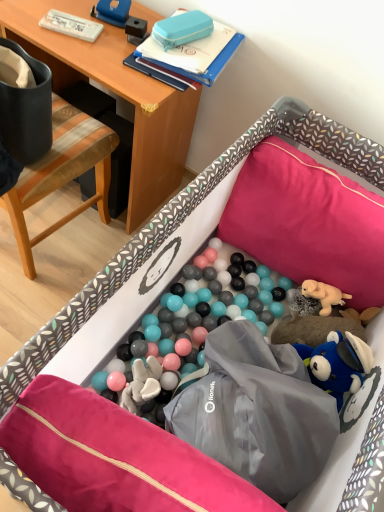
What are the coordinates of `pink fabric pillow at center, which appears as the 2th pillow when viewed from the back` in the screenshot? It's located at click(114, 457).

The width and height of the screenshot is (384, 512). Describe the element at coordinates (114, 92) in the screenshot. I see `wooden desk at upper left` at that location.

Where is `blue hard plastic case at upper center`? The width and height of the screenshot is (384, 512). blue hard plastic case at upper center is located at coordinates (182, 29).

The image size is (384, 512). Identify the location of pink fabric pillow at center, which is the second pillow in top-to-bottom order. (114, 457).

From a real-world perspective, is blue hard plastic case at upper center above or below pink fabric pillow at center, which is counted as the second pillow, starting from the right?

From a real-world perspective, blue hard plastic case at upper center is physically above pink fabric pillow at center, which is counted as the second pillow, starting from the right.

Which object is wider, blue hard plastic case at upper center or pink fabric pillow at center, which ranks as the 1th pillow in front-to-back order?

With larger width is blue hard plastic case at upper center.

Is blue hard plastic case at upper center in contact with pink fabric pillow at center, positioned as the 1th pillow in bottom-to-top order?

There is a gap between blue hard plastic case at upper center and pink fabric pillow at center, positioned as the 1th pillow in bottom-to-top order.

Is blue hard plastic case at upper center shorter than pink fabric pillow at center, which is the first pillow in left-to-right order?

Yes, blue hard plastic case at upper center is shorter than pink fabric pillow at center, which is the first pillow in left-to-right order.

From the picture: Which is behind, pink fabric pillow at upper right, which ranks as the first pillow in back-to-front order, or blue hard plastic case at upper center?

blue hard plastic case at upper center is more distant.

Can you confirm if pink fabric pillow at upper right, the 2th pillow positioned from the front, is taller than blue hard plastic case at upper center?

Yes.

From the image's perspective, which one is positioned lower, pink fabric pillow at upper right, which is counted as the second pillow, starting from the left, or blue hard plastic case at upper center?

pink fabric pillow at upper right, which is counted as the second pillow, starting from the left, is shown below in the image.

Is pink fabric pillow at upper right, which is counted as the second pillow, starting from the left, positioned with its back to blue hard plastic case at upper center?

pink fabric pillow at upper right, which is counted as the second pillow, starting from the left, does not have its back to blue hard plastic case at upper center.

From a real-world perspective, is wooden desk at upper left over pink fabric pillow at center, which ranks as the 1th pillow in front-to-back order?

No.

Based on the photo, is wooden desk at upper left to the right of pink fabric pillow at center, which ranks as the 1th pillow in front-to-back order, from the viewer's perspective?

No.

From the image's perspective, does wooden desk at upper left appear lower than pink fabric pillow at center, which is counted as the second pillow, starting from the right?

Actually, wooden desk at upper left appears above pink fabric pillow at center, which is counted as the second pillow, starting from the right, in the image.

Is wooden desk at upper left positioned with its back to pink fabric pillow at center, which is the second pillow in top-to-bottom order?

No, wooden desk at upper left's orientation is not away from pink fabric pillow at center, which is the second pillow in top-to-bottom order.

From a real-world perspective, which is physically below, pink fabric pillow at upper right, which ranks as the first pillow in back-to-front order, or pink fabric pillow at center, which is counted as the second pillow, starting from the right?

From a 3D spatial view, pink fabric pillow at center, which is counted as the second pillow, starting from the right, is below.

Which point is more forward, (371, 287) or (220, 485)?

The point (220, 485) is closer.

From the image's perspective, which object appears higher, pink fabric pillow at upper right, the 1th pillow positioned from the right, or pink fabric pillow at center, which is the first pillow in left-to-right order?

pink fabric pillow at upper right, the 1th pillow positioned from the right, is shown above in the image.

Can you tell me how much pink fabric pillow at upper right, the 1th pillow when ordered from top to bottom, and wooden desk at upper left differ in facing direction?

There is a 90.2-degree angle between the facing directions of pink fabric pillow at upper right, the 1th pillow when ordered from top to bottom, and wooden desk at upper left.

From a real-world perspective, who is located higher, pink fabric pillow at upper right, the 2th pillow positioned from the front, or wooden desk at upper left?

pink fabric pillow at upper right, the 2th pillow positioned from the front, is physically above.

Is pink fabric pillow at upper right, placed as the 2th pillow when sorted from bottom to top, in front of or behind wooden desk at upper left in the image?

In the image, pink fabric pillow at upper right, placed as the 2th pillow when sorted from bottom to top, appears in front of wooden desk at upper left.

How much distance is there between pink fabric pillow at upper right, the 1th pillow when ordered from top to bottom, and wooden desk at upper left?

pink fabric pillow at upper right, the 1th pillow when ordered from top to bottom, is 57.94 centimeters away from wooden desk at upper left.

Is point (203, 37) farther from camera compared to point (128, 217)?

That is False.

Which object is further away from the camera, blue hard plastic case at upper center or wooden desk at upper left?

blue hard plastic case at upper center is further from the camera.

Is blue hard plastic case at upper center spatially inside wooden desk at upper left, or outside of it?

blue hard plastic case at upper center exists outside the volume of wooden desk at upper left.

Consider the image. Who is bigger, blue hard plastic case at upper center or wooden desk at upper left?

wooden desk at upper left.

Does woodenchair at left touch pink fabric pillow at upper right, which is counted as the second pillow, starting from the left?

No.

Is pink fabric pillow at upper right, placed as the 2th pillow when sorted from bottom to top, located within woodenchair at left?

No.

Which is nearer, [28,191] or [292,214]?

Point [28,191].

How different are the orientations of woodenchair at left and pink fabric pillow at upper right, placed as the 2th pillow when sorted from bottom to top, in degrees?

woodenchair at left and pink fabric pillow at upper right, placed as the 2th pillow when sorted from bottom to top, are facing 88.4 degrees away from each other.

The width and height of the screenshot is (384, 512). Find the location of `toy on the left of pink fabric pillow at center, which appears as the 2th pillow when viewed from the back`. toy on the left of pink fabric pillow at center, which appears as the 2th pillow when viewed from the back is located at coordinates (182, 29).

From the image's perspective, which pillow is the 1st one below the blue hard plastic case at upper center? Please provide its 2D coordinates.

[(307, 222)]

Estimate the real-world distances between objects in this image. Which object is closer to pink fabric pillow at upper right, which is counted as the second pillow, starting from the left, wooden desk at upper left or blue hard plastic case at upper center?

The object closer to pink fabric pillow at upper right, which is counted as the second pillow, starting from the left, is wooden desk at upper left.

Based on their spatial positions, is blue hard plastic case at upper center or pink fabric pillow at upper right, which is counted as the second pillow, starting from the left, further from pink fabric pillow at center, which ranks as the 1th pillow in front-to-back order?

The object further to pink fabric pillow at center, which ranks as the 1th pillow in front-to-back order, is blue hard plastic case at upper center.

Based on their spatial positions, is blue hard plastic case at upper center or pink fabric pillow at center, which is counted as the second pillow, starting from the right, closer to pink fabric pillow at upper right, which ranks as the first pillow in back-to-front order?

Based on the image, blue hard plastic case at upper center appears to be nearer to pink fabric pillow at upper right, which ranks as the first pillow in back-to-front order.

Considering their positions, is pink fabric pillow at center, which is the second pillow in top-to-bottom order, positioned further to pink fabric pillow at upper right, the 1th pillow when ordered from top to bottom, than wooden desk at upper left?

pink fabric pillow at center, which is the second pillow in top-to-bottom order, lies further to pink fabric pillow at upper right, the 1th pillow when ordered from top to bottom, than the other object.

Estimate the real-world distances between objects in this image. Which object is further from pink fabric pillow at upper right, which ranks as the first pillow in back-to-front order, blue hard plastic case at upper center or woodenchair at left?

woodenchair at left is further to pink fabric pillow at upper right, which ranks as the first pillow in back-to-front order.

Considering their positions, is wooden desk at upper left positioned further to woodenchair at left than pink fabric pillow at center, which appears as the 2th pillow when viewed from the back?

pink fabric pillow at center, which appears as the 2th pillow when viewed from the back, lies further to woodenchair at left than the other object.

Based on their spatial positions, is woodenchair at left or blue hard plastic case at upper center further from wooden desk at upper left?

The object further to wooden desk at upper left is blue hard plastic case at upper center.

When comparing their distances from pink fabric pillow at center, which is the first pillow in left-to-right order, does woodenchair at left or blue hard plastic case at upper center seem further?

The object further to pink fabric pillow at center, which is the first pillow in left-to-right order, is blue hard plastic case at upper center.

You are a GUI agent. You are given a task and a screenshot of the screen. Output one action in this format:
    pyautogui.click(x=<x>, y=<y>)
    Task: Click on the desk situated between woodenchair at left and pink fabric pillow at upper right, the 2th pillow positioned from the front, from left to right
    Image resolution: width=384 pixels, height=512 pixels.
    Given the screenshot: What is the action you would take?
    pyautogui.click(x=114, y=92)

This screenshot has height=512, width=384. I want to click on desk situated between woodenchair at left and blue hard plastic case at upper center from left to right, so click(x=114, y=92).

Identify the location of chair between wooden desk at upper left and pink fabric pillow at center, which is the first pillow in left-to-right order, in the up-down direction. (62, 173).

The height and width of the screenshot is (512, 384). What are the coordinates of `toy located between woodenchair at left and pink fabric pillow at upper right, which is counted as the second pillow, starting from the left, in the left-right direction` in the screenshot? It's located at (182, 29).